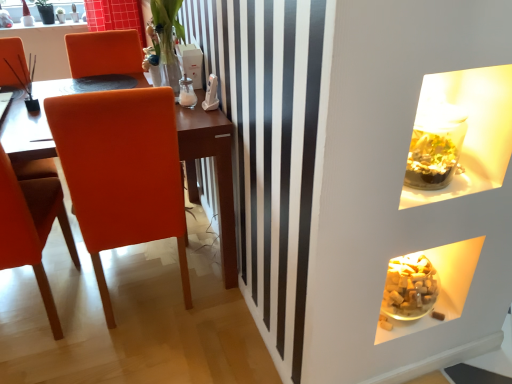
Locate an element on the screen. This screenshot has width=512, height=384. free location to the right of translucent glass cubes at lower right, which appears as the 2th food when viewed from the right is located at coordinates (425, 313).